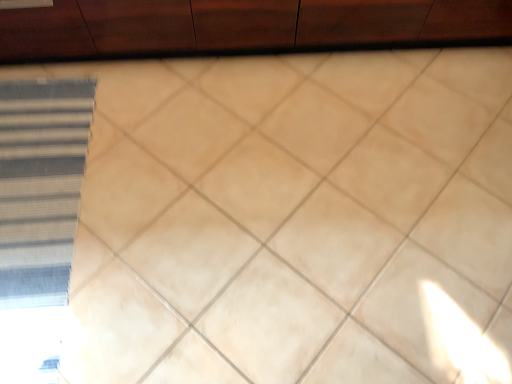
Identify the location of vacant area on top of textured beige curtain at left (from a real-world perspective). (22, 225).